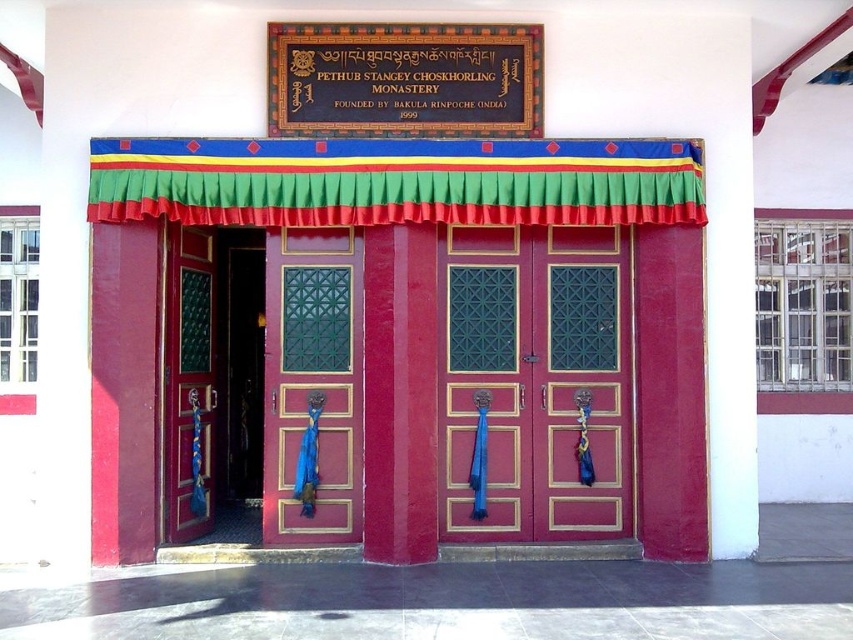
Question: Can you confirm if green fabric curtain at upper center is thinner than goldmaterial/textureinscription at upper center?

Choices:
 (A) no
 (B) yes

Answer: (A)

Question: Which object appears closest to the camera in this image?

Choices:
 (A) matte red wooden door at center
 (B) goldmetallicsignboard at upper center

Answer: (B)

Question: Does green fabric curtain at upper center have a greater width compared to green glossy door at center?

Choices:
 (A) no
 (B) yes

Answer: (B)

Question: Does green fabric curtain at upper center come behind goldmaterial/textureinscription at upper center?

Choices:
 (A) no
 (B) yes

Answer: (A)

Question: Which of the following is the closest to the observer?

Choices:
 (A) green fabric curtain at upper center
 (B) goldmetallicsignboard at upper center
 (C) green glossy door at center
 (D) goldmaterial/textureinscription at upper center

Answer: (A)

Question: Which of the following is the farthest from the observer?

Choices:
 (A) (277, 42)
 (B) (361, 412)

Answer: (B)